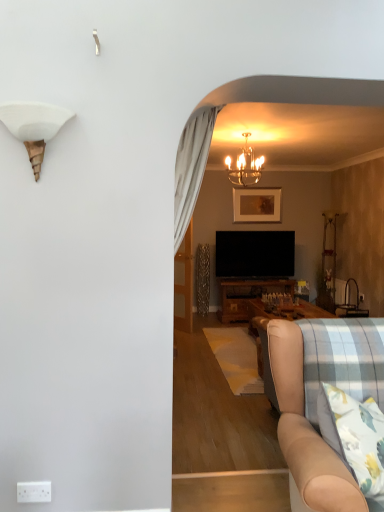
Image resolution: width=384 pixels, height=512 pixels. I want to click on white matte shell at upper left, the 1th lamp in the bottom-to-top sequence, so click(x=34, y=127).

Where is `beige fabric couch at lower right`? Image resolution: width=384 pixels, height=512 pixels. beige fabric couch at lower right is located at coordinates point(305,432).

Where is `white matte shell at upper left, the 2th lamp from the back`? This screenshot has height=512, width=384. white matte shell at upper left, the 2th lamp from the back is located at coordinates (34, 127).

Which object is wider, beige fabric couch at lower right or white plastic power outlet at lower left?

beige fabric couch at lower right.

Is beige fabric couch at lower right in front of or behind white plastic power outlet at lower left in the image?

Clearly, beige fabric couch at lower right is in front of white plastic power outlet at lower left.

Is beige fabric couch at lower right far away from white plastic power outlet at lower left?

That's right, there is a large distance between beige fabric couch at lower right and white plastic power outlet at lower left.

Is beige fabric couch at lower right at the right side of white plastic power outlet at lower left?

Correct, you'll find beige fabric couch at lower right to the right of white plastic power outlet at lower left.

Is white matte shell at upper left, the 1th lamp from the front, far away from white plastic power outlet at lower left?

Indeed, white matte shell at upper left, the 1th lamp from the front, is not near white plastic power outlet at lower left.

Does white matte shell at upper left, acting as the first lamp starting from the left, have a larger size compared to white plastic power outlet at lower left?

Yes, white matte shell at upper left, acting as the first lamp starting from the left, is bigger than white plastic power outlet at lower left.

Based on the photo, is white matte shell at upper left, the 2th lamp in the top-to-bottom sequence, facing away from white plastic power outlet at lower left?

white matte shell at upper left, the 2th lamp in the top-to-bottom sequence, does not have its back to white plastic power outlet at lower left.

Locate an element on the screen. power outlet below the white matte shell at upper left, positioned as the second lamp in right-to-left order (from a real-world perspective) is located at coordinates (34, 492).

Is translucent glass chandelier at upper center, the first lamp viewed from the back, at the left side of white plastic power outlet at lower left?

No.

From a real-world perspective, who is located higher, translucent glass chandelier at upper center, the second lamp from the front, or white plastic power outlet at lower left?

In real-world perspective, translucent glass chandelier at upper center, the second lamp from the front, is above.

Who is taller, translucent glass chandelier at upper center, the second lamp when ordered from left to right, or white plastic power outlet at lower left?

translucent glass chandelier at upper center, the second lamp when ordered from left to right.

Which lamp is the 2nd one when counting from the right side of the white plastic power outlet at lower left? Please provide its 2D coordinates.

[(245, 166)]

Considering the sizes of objects wooden framed artwork at center and beige fabric couch at lower right in the image provided, who is shorter, wooden framed artwork at center or beige fabric couch at lower right?

wooden framed artwork at center.

Looking at this image, can you tell me how much wooden framed artwork at center and beige fabric couch at lower right differ in facing direction?

The angular difference between wooden framed artwork at center and beige fabric couch at lower right is 1.31 degrees.

Find the location of a particular element. Image resolution: width=384 pixels, height=512 pixels. picture frame that appears above the beige fabric couch at lower right (from a real-world perspective) is located at coordinates (257, 205).

Which object is wider, wooden framed artwork at center or beige fabric couch at lower right?

Wider between the two is beige fabric couch at lower right.

From a real-world perspective, is translucent glass chandelier at upper center, marked as the first lamp in a right-to-left arrangement, positioned over transparent glass door at center based on gravity?

Yes, from a real-world perspective, translucent glass chandelier at upper center, marked as the first lamp in a right-to-left arrangement, is on top of transparent glass door at center.

Does point (254, 158) come in front of point (179, 258)?

No, (254, 158) is behind (179, 258).

Is translucent glass chandelier at upper center, the second lamp from the front, not close to transparent glass door at center?

Yes, translucent glass chandelier at upper center, the second lamp from the front, and transparent glass door at center are quite far apart.

Identify the location of lamp lying on the right of transparent glass door at center. The image size is (384, 512). (245, 166).

Considering the relative sizes of white plastic power outlet at lower left and beige fabric couch at lower right in the image provided, is white plastic power outlet at lower left taller than beige fabric couch at lower right?

No.

Is white plastic power outlet at lower left in front of or behind beige fabric couch at lower right in the image?

In the image, white plastic power outlet at lower left appears behind beige fabric couch at lower right.

Is white plastic power outlet at lower left thinner than beige fabric couch at lower right?

Correct, the width of white plastic power outlet at lower left is less than that of beige fabric couch at lower right.

Is white plastic power outlet at lower left outside of beige fabric couch at lower right?

Yes.

Does transparent glass door at center turn towards translucent glass chandelier at upper center, which ranks as the first lamp in top-to-bottom order?

No, transparent glass door at center is not oriented towards translucent glass chandelier at upper center, which ranks as the first lamp in top-to-bottom order.

Between transparent glass door at center and translucent glass chandelier at upper center, marked as the first lamp in a right-to-left arrangement, which one is positioned in front?

Positioned in front is translucent glass chandelier at upper center, marked as the first lamp in a right-to-left arrangement.

Does point (189, 279) come in front of point (247, 136)?

No.

From a real-world perspective, who is located lower, transparent glass door at center or translucent glass chandelier at upper center, the first lamp viewed from the back?

transparent glass door at center.

Where is `power outlet that is on the left side of beige fabric couch at lower right`? power outlet that is on the left side of beige fabric couch at lower right is located at coordinates (34, 492).

You are a GUI agent. You are given a task and a screenshot of the screen. Output one action in this format:
    pyautogui.click(x=<x>, y=<y>)
    Task: Click on the power outlet behind the white matte shell at upper left, acting as the first lamp starting from the left
    The height and width of the screenshot is (512, 384).
    Given the screenshot: What is the action you would take?
    pyautogui.click(x=34, y=492)

From the picture: Looking at the image, which one is located further to white plastic power outlet at lower left, wooden framed artwork at center or translucent glass chandelier at upper center, which ranks as the first lamp in top-to-bottom order?

The object further to white plastic power outlet at lower left is wooden framed artwork at center.

Looking at the image, which one is located closer to wooden framed artwork at center, white matte shell at upper left, the 2th lamp in the top-to-bottom sequence, or translucent glass chandelier at upper center, which ranks as the first lamp in top-to-bottom order?

translucent glass chandelier at upper center, which ranks as the first lamp in top-to-bottom order, is closer to wooden framed artwork at center.

Based on the photo, from the image, which object appears to be nearer to translucent glass chandelier at upper center, the second lamp when ordered from left to right, white matte shell at upper left, positioned as the second lamp in right-to-left order, or white plastic power outlet at lower left?

white matte shell at upper left, positioned as the second lamp in right-to-left order, is closer to translucent glass chandelier at upper center, the second lamp when ordered from left to right.

Estimate the real-world distances between objects in this image. Which object is closer to translucent glass chandelier at upper center, the first lamp viewed from the back, wooden framed artwork at center or white matte shell at upper left, positioned as the second lamp in right-to-left order?

Among the two, wooden framed artwork at center is located nearer to translucent glass chandelier at upper center, the first lamp viewed from the back.

Estimate the real-world distances between objects in this image. Which object is closer to beige fabric couch at lower right, translucent glass chandelier at upper center, the first lamp viewed from the back, or wooden framed artwork at center?

translucent glass chandelier at upper center, the first lamp viewed from the back, is closer to beige fabric couch at lower right.

Based on their spatial positions, is translucent glass chandelier at upper center, the second lamp from the front, or white matte shell at upper left, the 2th lamp in the top-to-bottom sequence, closer to white plastic power outlet at lower left?

Among the two, white matte shell at upper left, the 2th lamp in the top-to-bottom sequence, is located nearer to white plastic power outlet at lower left.

From the image, which object appears to be nearer to beige fabric couch at lower right, white matte shell at upper left, acting as the first lamp starting from the left, or wooden framed artwork at center?

Among the two, white matte shell at upper left, acting as the first lamp starting from the left, is located nearer to beige fabric couch at lower right.

Based on the photo, looking at the image, which one is located further to transparent glass door at center, translucent glass chandelier at upper center, which ranks as the first lamp in top-to-bottom order, or wooden framed artwork at center?

The object further to transparent glass door at center is translucent glass chandelier at upper center, which ranks as the first lamp in top-to-bottom order.

Locate an element on the screen. power outlet between beige fabric couch at lower right and translucent glass chandelier at upper center, marked as the first lamp in a right-to-left arrangement, in the front-back direction is located at coordinates (34, 492).

Image resolution: width=384 pixels, height=512 pixels. In order to click on power outlet between white matte shell at upper left, the 2th lamp in the top-to-bottom sequence, and wooden framed artwork at center, along the z-axis in this screenshot , I will do `click(34, 492)`.

Image resolution: width=384 pixels, height=512 pixels. What are the coordinates of `lamp between white matte shell at upper left, the 1th lamp from the front, and transparent glass door at center in the front-back direction` in the screenshot? It's located at coord(245,166).

Where is `lamp between white matte shell at upper left, the 2th lamp from the back, and wooden framed artwork at center, along the z-axis`? Image resolution: width=384 pixels, height=512 pixels. lamp between white matte shell at upper left, the 2th lamp from the back, and wooden framed artwork at center, along the z-axis is located at coordinates (245, 166).